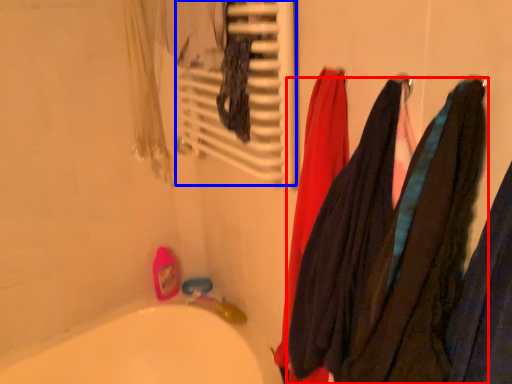
Question: Which of the following is the farthest to the observer, towel (highlighted by a red box) or radiator (highlighted by a blue box)?

Choices:
 (A) towel
 (B) radiator

Answer: (B)